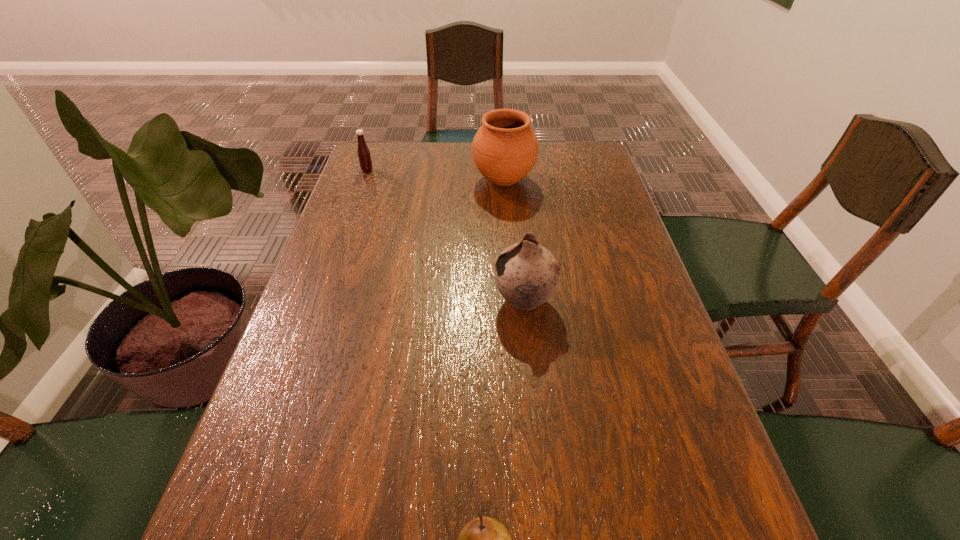
Locate an element on the screen. The width and height of the screenshot is (960, 540). the farther pottery is located at coordinates (505, 148).

Find the location of a particular element. This screenshot has width=960, height=540. the nearer pottery is located at coordinates (526, 274).

The image size is (960, 540). I want to click on the leftmost object, so click(363, 152).

The width and height of the screenshot is (960, 540). I want to click on the third tallest object, so click(x=363, y=152).

I want to click on free space located 0.200m on the right of the farther pottery, so click(x=597, y=180).

This screenshot has height=540, width=960. Identify the location of free space located 0.050m from the spout of the third farthest object. (472, 300).

This screenshot has height=540, width=960. What are the coordinates of `free region located 0.090m from the spout of the third farthest object` in the screenshot? It's located at (455, 300).

Locate an element on the screen. free space located from the spout of the third farthest object is located at coordinates (383, 300).

This screenshot has height=540, width=960. Find the location of `free spot located on the right of the Tabasco sauce`. free spot located on the right of the Tabasco sauce is located at coordinates (448, 170).

This screenshot has width=960, height=540. What are the coordinates of `pottery that is at the far edge` in the screenshot? It's located at (505, 148).